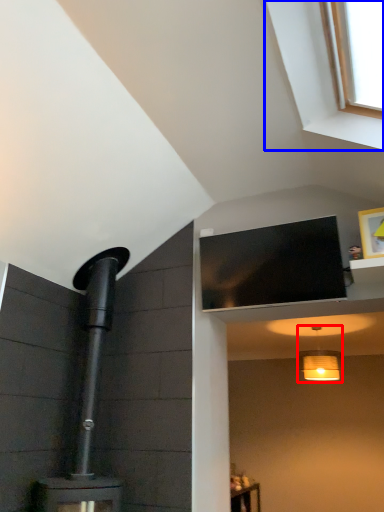
Question: Which object is closer to the camera taking this photo, light fixture (highlighted by a red box) or window (highlighted by a blue box)?

Choices:
 (A) light fixture
 (B) window

Answer: (B)